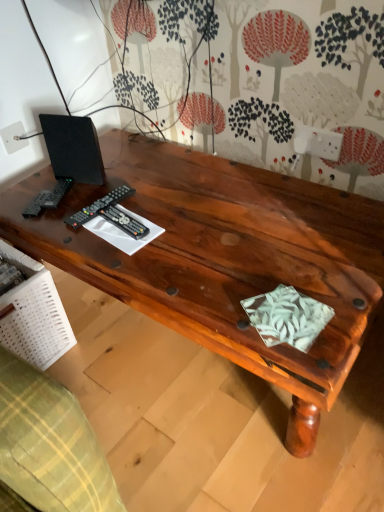
Identify the location of vacant area that lies to the right of black plastic remote at left, the second control viewed from the right. (168, 210).